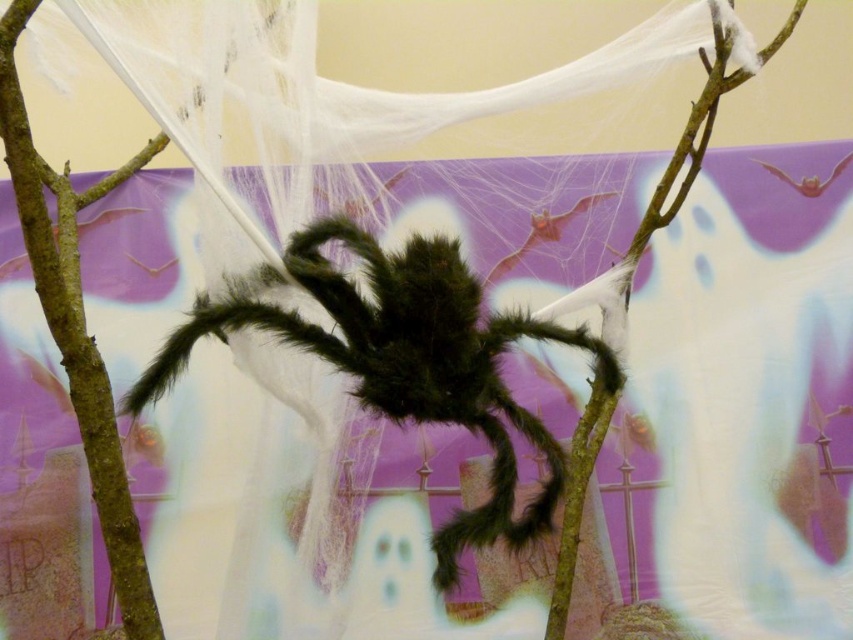
You are setting up a Halloween display and want to ensure the fuzzy black spider at center is visible against the brown rough tree branch at center. Based on their sizes, which object should you place in front to ensure visibility?

The fuzzy black spider at center should be placed in front of the brown rough tree branch at center because it might be wider, ensuring it stands out more prominently.

You are planning to place a Halloween decoration in your living room. You have the fuzzy black spider at center and the brown rough tree branch at center. Which object should you choose if you want something bigger to be the focal point of your display?

The fuzzy black spider at center is larger in size than the brown rough tree branch at center, so you should choose the fuzzy black spider at center as the focal point since it is bigger.

You are setting up a Halloween display and want to place a decorative pumpkin exactly 0.3 units to the right of the fuzzy black spider at center. Where should you place the pumpkin in terms of coordinates?

The fuzzy black spider at center is located at coordinates point (403, 360). To place the pumpkin 0.3 units to the right, the new coordinates would be x coordinate 0.564 plus 0.3 equals 0.864, y coordinate remains 0.474. So the pumpkin should be placed at point (403, 552).